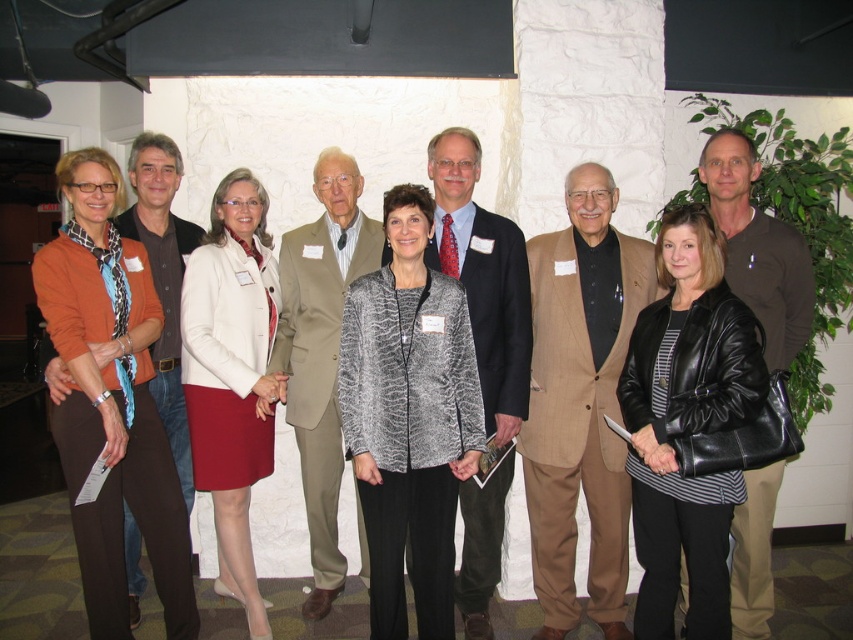
You are standing in the room and see the image. There is a point at coordinates (109, 401). What object is located at that point?

The point at coordinates (109, 401) corresponds to the matte orange sweater at left.

In the scene shown: You are a photographer trying to adjust the composition of the group photo. You want to ensure that the matte orange sweater at left and the black leather jacket at center are both clearly visible. Based on their current positions, which object is blocking the view of the other?

The black leather jacket at center is behind the matte orange sweater at left, so the matte orange sweater at left is blocking the view of the black leather jacket at center.